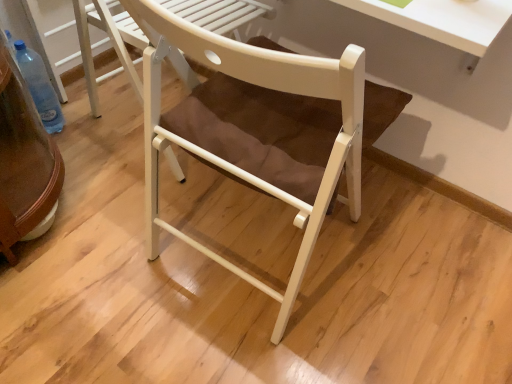
You are a GUI agent. You are given a task and a screenshot of the screen. Output one action in this format:
    pyautogui.click(x=<x>, y=<y>)
    Task: Click on the blank area beneath white wood chair at center, which is counted as the second chair, starting from the back (from a real-world perspective)
    This screenshot has width=512, height=384.
    Given the screenshot: What is the action you would take?
    pyautogui.click(x=254, y=242)